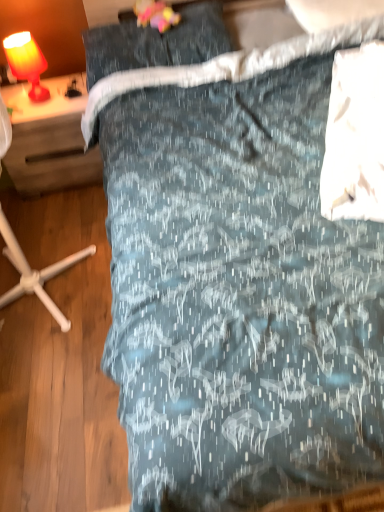
Where is `blank space situated above matte wood desk at left (from a real-world perspective)`? blank space situated above matte wood desk at left (from a real-world perspective) is located at coordinates (58, 95).